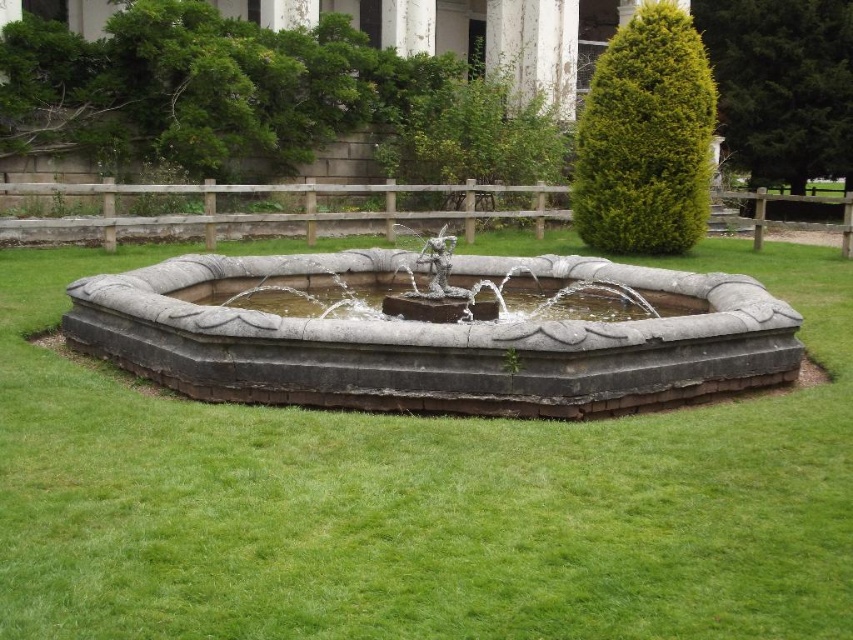
You are planning to place a small garden statue that is 1 meter wide between the green grass at center and the gray stone fountain at center. Based on the scene description, can you determine if there is enough space between them to place the statue?

The green grass at center might be wider than the gray stone fountain at center, so there might be enough space to place the 1 meter wide statue between them. However, the exact width isn not specified, so it depends on the actual spacing between the two.